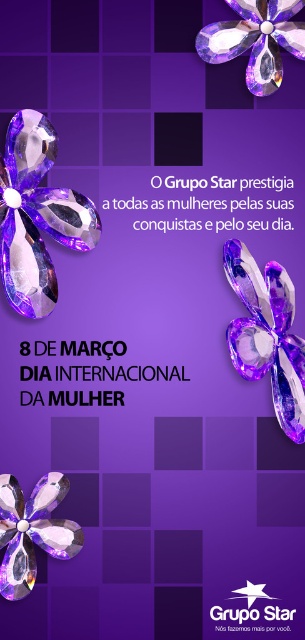
Based on the photo, you are designing a layout for a promotional poster and need to place two flowers. The matte purple flower at upper right and the amber crystal flower at upper center are both part of the design. Which flower has a smaller width?

The matte purple flower at upper right has a lesser width compared to the amber crystal flower at upper center.

You are looking at the promotional graphic and want to place a small sticker exactly halfway between the two points labeled point (50,134) and point (261,336). Considering their positions, will the sticker be closer to the front or the back of the image?

The sticker will be closer to the front of the image because point (50,134) is in front of point (261,336), so the midpoint between them would still be nearer to the front point.

You are designing a layout for a promotional poster and want to ensure proper visibility of both the matte purple flower at lower left and the amber crystal flower at upper center. Based on their positions, which flower might appear closer to the viewer?

The matte purple flower at lower left appears closer to the viewer because the amber crystal flower at upper center is positioned behind it.